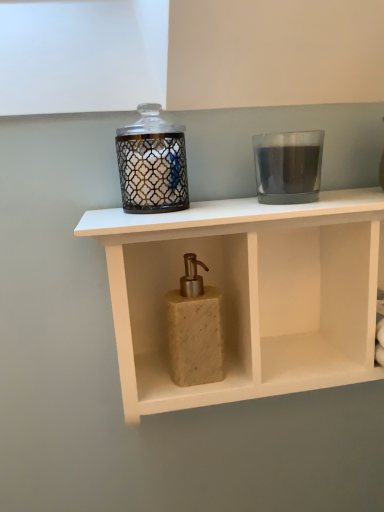
The image size is (384, 512). In order to click on empty space that is ontop of beige stone soap dispenser at center (from a real-world perspective) in this screenshot , I will do `click(242, 205)`.